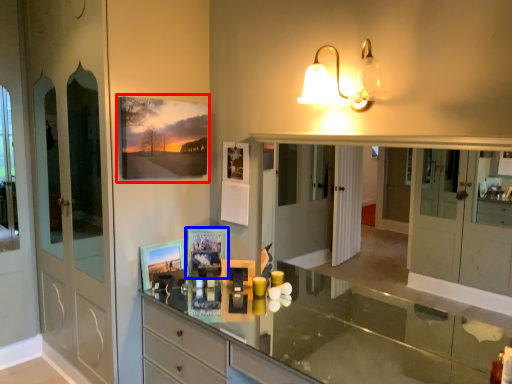
Question: Among these objects, which one is nearest to the camera, picture frame (highlighted by a red box) or picture frame (highlighted by a blue box)?

Choices:
 (A) picture frame
 (B) picture frame

Answer: (A)